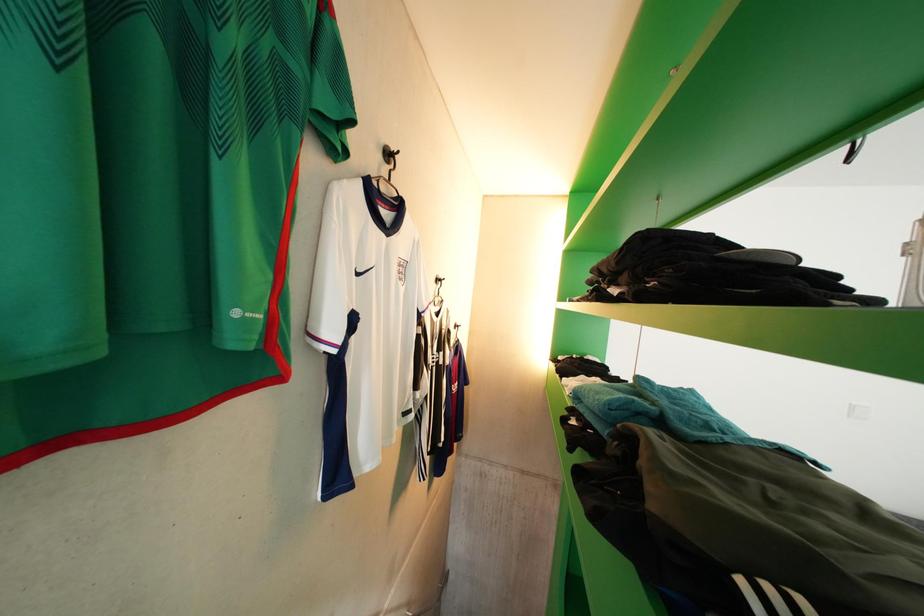
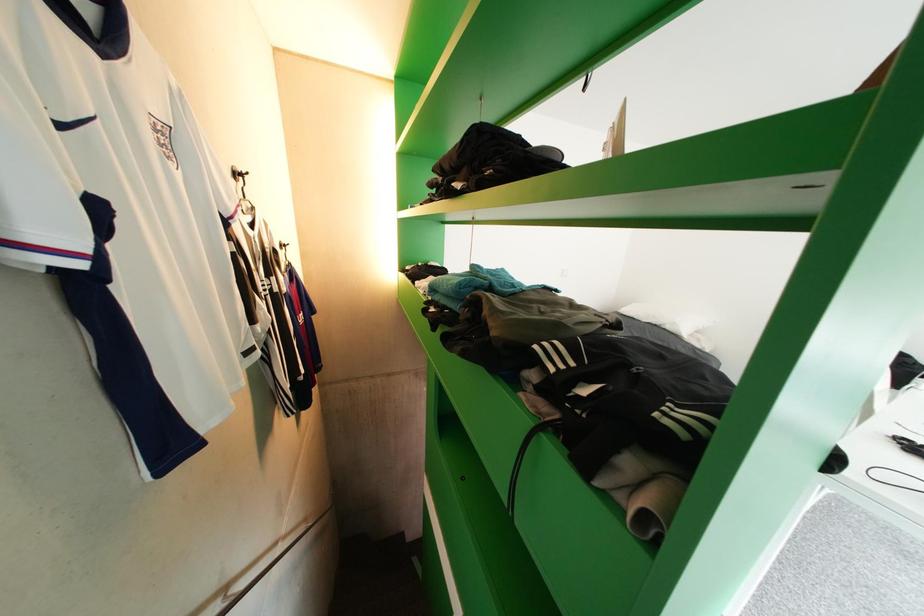
The first image is from the beginning of the video and the second image is from the end. How did the camera likely rotate when shooting the video?

The rotation direction of the camera is right-down.